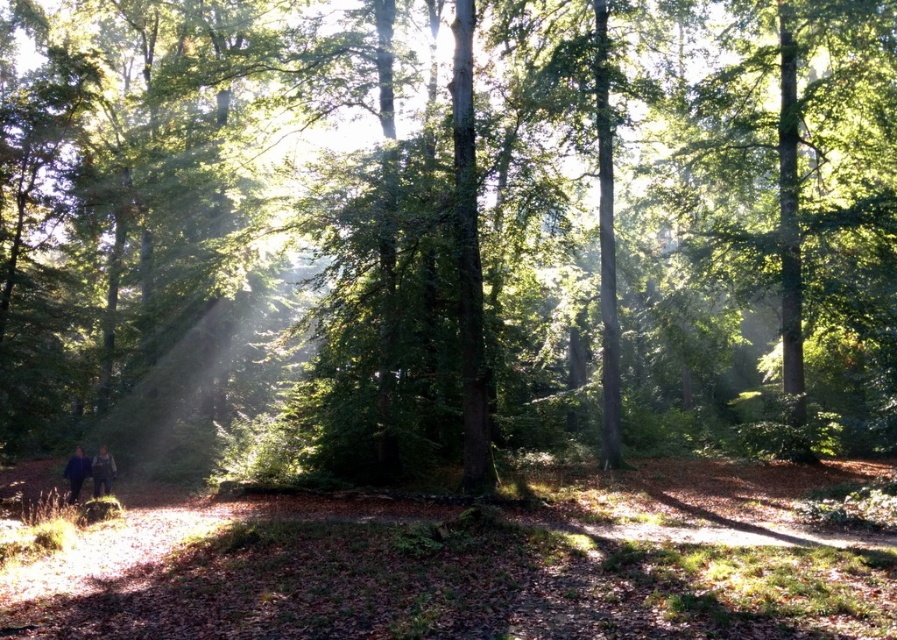
Who is more forward, (103, 461) or (77, 483)?

Positioned in front is point (77, 483).

Does dark blue fabric at lower left appear on the left side of dark blue jacket at lower left?

No, dark blue fabric at lower left is not to the left of dark blue jacket at lower left.

Image resolution: width=897 pixels, height=640 pixels. I want to click on dark blue fabric at lower left, so click(x=102, y=472).